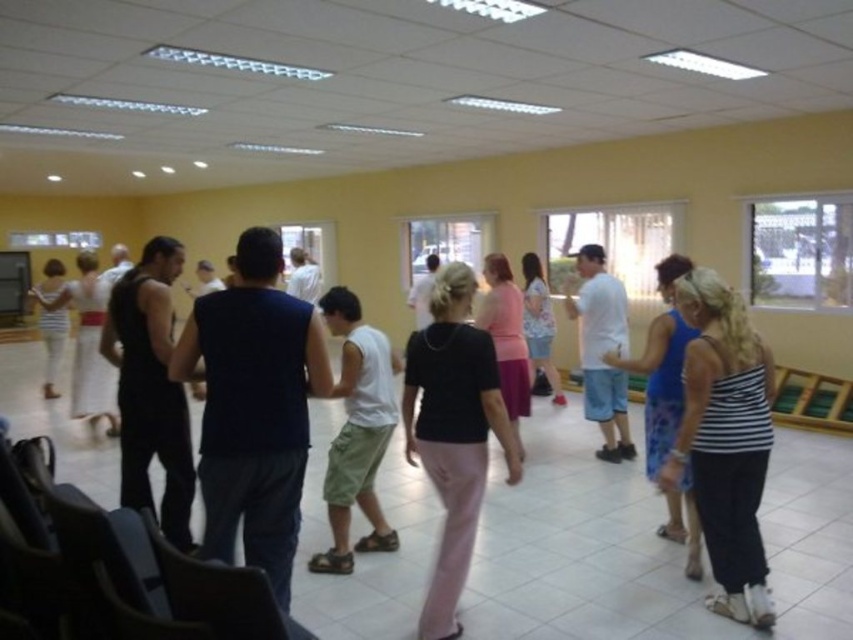
Question: Is dark blue sleeveless shirt at center smaller than striped fabric top at lower right?

Choices:
 (A) yes
 (B) no

Answer: (B)

Question: Which of the following is the farthest from the observer?

Choices:
 (A) (496, 321)
 (B) (61, 340)
 (C) (265, 497)
 (D) (648, 468)

Answer: (B)

Question: Which object is positioned farthest from the black matte shirt at center?

Choices:
 (A) blue fabric dress at center
 (B) dark blue sleeveless shirt at center
 (C) white cotton tank top at center

Answer: (A)

Question: Which point is closer to the camera taking this photo?

Choices:
 (A) (669, 344)
 (B) (724, 324)
 (C) (62, 273)

Answer: (B)

Question: Where is white cotton tank top at center located in relation to blue fabric dress at center in the image?

Choices:
 (A) above
 (B) below

Answer: (B)

Question: Can you confirm if dark blue sleeveless shirt at center is positioned above white cotton dress at left?

Choices:
 (A) yes
 (B) no

Answer: (B)